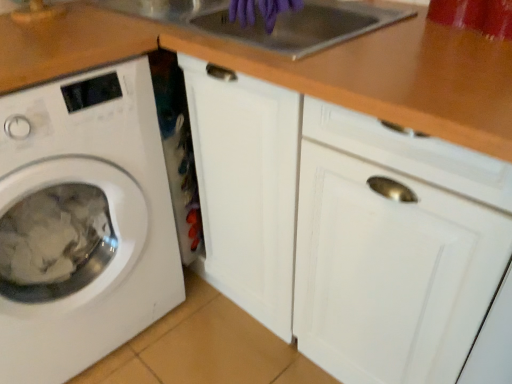
Question: Does wooden at upper center have a lesser height compared to purple rubber gloves at upper center?

Choices:
 (A) yes
 (B) no

Answer: (A)

Question: Considering the relative positions of wooden at upper center and purple rubber gloves at upper center in the image provided, is wooden at upper center to the right of purple rubber gloves at upper center from the viewer's perspective?

Choices:
 (A) yes
 (B) no

Answer: (B)

Question: Are wooden at upper center and purple rubber gloves at upper center located far from each other?

Choices:
 (A) yes
 (B) no

Answer: (B)

Question: Is wooden at upper center aimed at purple rubber gloves at upper center?

Choices:
 (A) yes
 (B) no

Answer: (B)

Question: Does wooden at upper center have a lesser width compared to purple rubber gloves at upper center?

Choices:
 (A) yes
 (B) no

Answer: (B)

Question: Is wooden at upper center further to camera compared to purple rubber gloves at upper center?

Choices:
 (A) yes
 (B) no

Answer: (B)

Question: Is purple rubber gloves at upper center directly adjacent to white matte washing machine at left?

Choices:
 (A) no
 (B) yes

Answer: (A)

Question: Does purple rubber gloves at upper center have a smaller size compared to white matte washing machine at left?

Choices:
 (A) yes
 (B) no

Answer: (A)

Question: Considering the relative positions of purple rubber gloves at upper center and white matte washing machine at left in the image provided, is purple rubber gloves at upper center in front of white matte washing machine at left?

Choices:
 (A) yes
 (B) no

Answer: (B)

Question: Is purple rubber gloves at upper center surrounding white matte washing machine at left?

Choices:
 (A) no
 (B) yes

Answer: (A)

Question: Is the position of purple rubber gloves at upper center more distant than that of white matte washing machine at left?

Choices:
 (A) yes
 (B) no

Answer: (A)

Question: Does purple rubber gloves at upper center have a greater height compared to white matte washing machine at left?

Choices:
 (A) yes
 (B) no

Answer: (B)

Question: Considering the relative sizes of white matte washing machine at left and wooden at upper center in the image provided, is white matte washing machine at left wider than wooden at upper center?

Choices:
 (A) no
 (B) yes

Answer: (B)